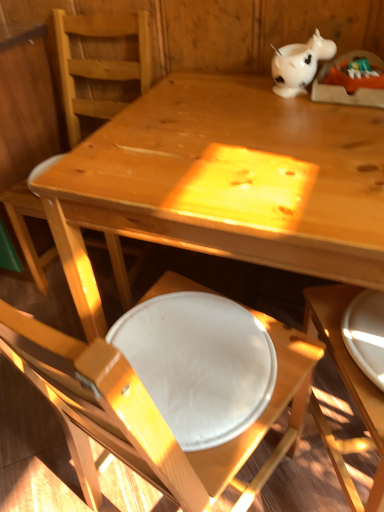
Question: In terms of size, does white glossy piggy bank at upper right appear bigger or smaller than white glossy plate at lower right?

Choices:
 (A) big
 (B) small

Answer: (A)

Question: From the image's perspective, is white glossy piggy bank at upper right positioned above or below white glossy plate at lower right?

Choices:
 (A) above
 (B) below

Answer: (A)

Question: Which object is positioned closest to the white glossy plate at lower right?

Choices:
 (A) white glossy plate at lower center, acting as the first chair starting from the front
 (B) matte wood chair at center, which ranks as the first chair in back-to-front order
 (C) white glossy piggy bank at upper right

Answer: (A)

Question: Which object is positioned farthest from the white glossy plate at lower right?

Choices:
 (A) white glossy piggy bank at upper right
 (B) white glossy plate at lower center, acting as the first chair starting from the front
 (C) matte wood chair at center, which ranks as the first chair in back-to-front order

Answer: (C)